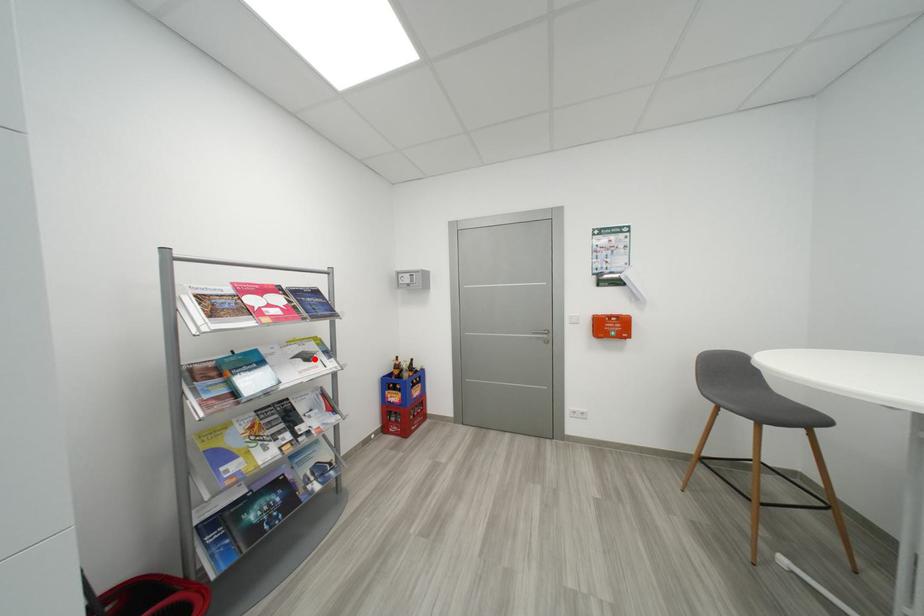
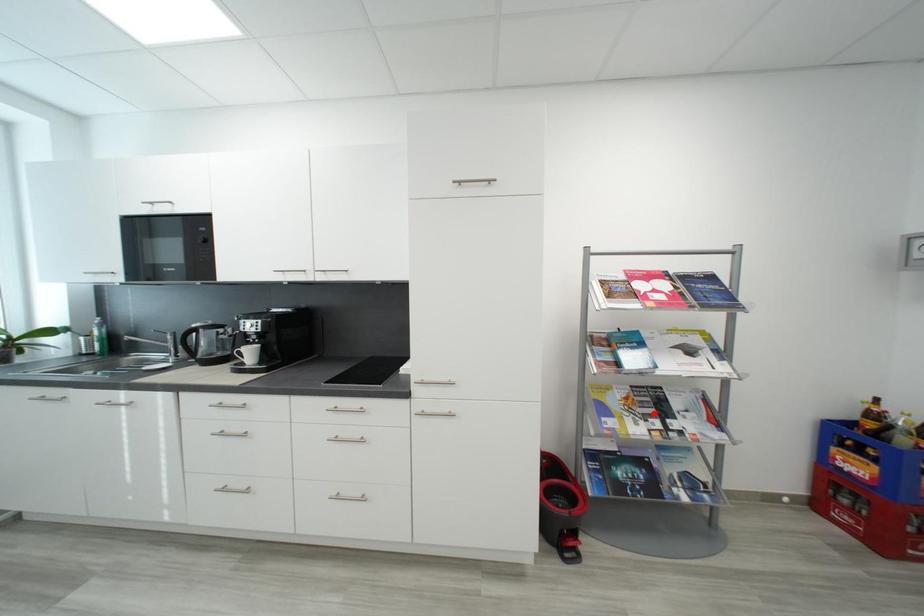
I am providing you with two images of the same scene from different viewpoints. A red point is marked on the first image and another point is marked on the second image. Is the marked point in image1 the same physical position as the marked point in image2?

No